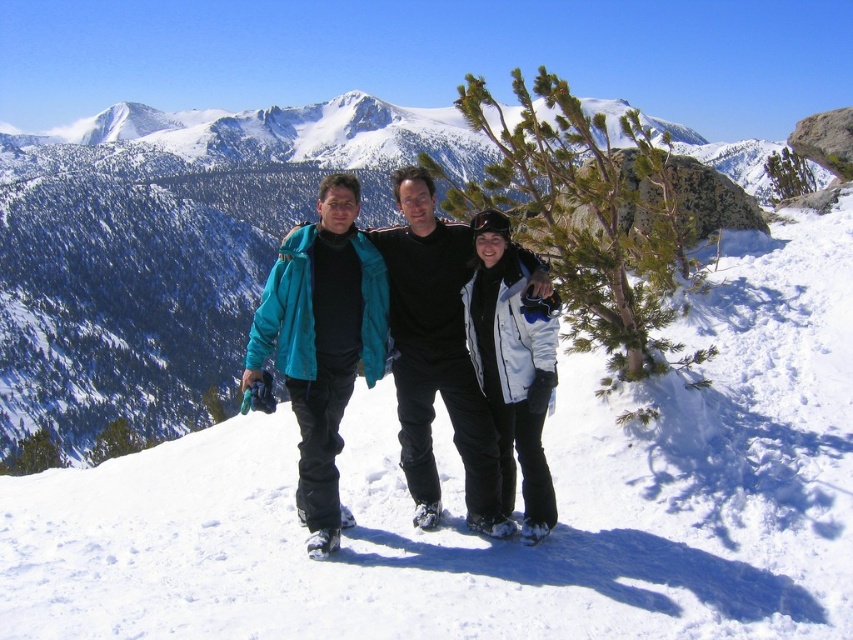
Question: Is white matte jacket at center closer to the viewer compared to white matte ski at lower center?

Choices:
 (A) no
 (B) yes

Answer: (B)

Question: Which is farther from the matte blue jacket at center?

Choices:
 (A) white matte ski at lower center
 (B) teal fabric jacket at center
 (C) white matte jacket at center

Answer: (A)

Question: Observing the image, what is the correct spatial positioning of matte blue jacket at center in reference to white matte ski at lower center?

Choices:
 (A) above
 (B) below

Answer: (A)

Question: Is white snow at center smaller than teal fabric jacket at center?

Choices:
 (A) no
 (B) yes

Answer: (A)

Question: Based on their relative distances, which object is farther from the white matte ski at lower center?

Choices:
 (A) white matte jacket at center
 (B) white snow at center

Answer: (B)

Question: Estimate the real-world distances between objects in this image. Which object is closer to the white matte jacket at center?

Choices:
 (A) white snow at center
 (B) matte blue jacket at center
 (C) teal fabric jacket at center

Answer: (B)